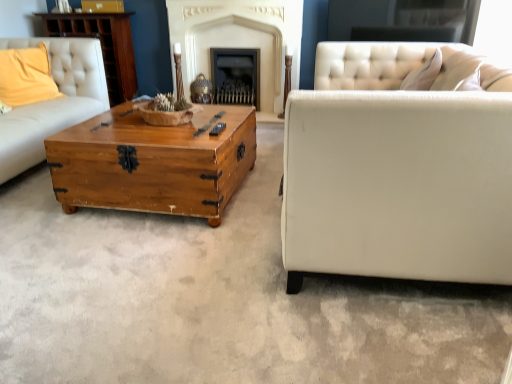
Question: Is yellow fabric pillow at upper left positioned in front of wooden dresser at upper left?

Choices:
 (A) yes
 (B) no

Answer: (A)

Question: Considering the relative positions of yellow fabric pillow at upper left and wooden dresser at upper left in the image provided, is yellow fabric pillow at upper left behind wooden dresser at upper left?

Choices:
 (A) no
 (B) yes

Answer: (A)

Question: Is yellow fabric pillow at upper left not inside wooden dresser at upper left?

Choices:
 (A) yes
 (B) no

Answer: (A)

Question: Is yellow fabric pillow at upper left oriented away from wooden dresser at upper left?

Choices:
 (A) no
 (B) yes

Answer: (A)

Question: From the image's perspective, is yellow fabric pillow at upper left located beneath wooden dresser at upper left?

Choices:
 (A) yes
 (B) no

Answer: (A)

Question: Is wooden trunk at center taller or shorter than yellow fabric pillow at upper left?

Choices:
 (A) tall
 (B) short

Answer: (B)

Question: Does point (158, 198) appear closer or farther from the camera than point (30, 61)?

Choices:
 (A) farther
 (B) closer

Answer: (B)

Question: Considering the positions of wooden trunk at center and yellow fabric pillow at upper left in the image, is wooden trunk at center wider or thinner than yellow fabric pillow at upper left?

Choices:
 (A) wide
 (B) thin

Answer: (A)

Question: In the image, is wooden trunk at center positioned in front of or behind yellow fabric pillow at upper left?

Choices:
 (A) behind
 (B) front

Answer: (B)

Question: In terms of size, does wooden dresser at upper left appear bigger or smaller than yellow fabric pillow at upper left?

Choices:
 (A) small
 (B) big

Answer: (B)

Question: From their relative heights in the image, would you say wooden dresser at upper left is taller or shorter than yellow fabric pillow at upper left?

Choices:
 (A) short
 (B) tall

Answer: (B)

Question: Do you think wooden dresser at upper left is within yellow fabric pillow at upper left, or outside of it?

Choices:
 (A) inside
 (B) outside

Answer: (B)

Question: From a real-world perspective, relative to yellow fabric pillow at upper left, is wooden dresser at upper left vertically above or below?

Choices:
 (A) below
 (B) above

Answer: (A)

Question: Considering their positions, is wooden trunk at center located in front of or behind wooden dresser at upper left?

Choices:
 (A) front
 (B) behind

Answer: (A)

Question: In terms of width, does wooden trunk at center look wider or thinner when compared to wooden dresser at upper left?

Choices:
 (A) thin
 (B) wide

Answer: (B)